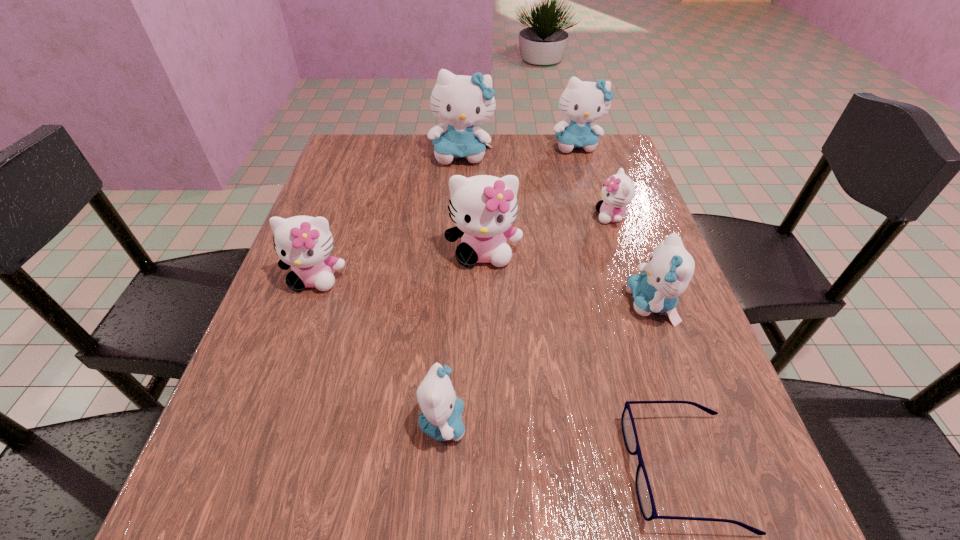
The image size is (960, 540). What are the coordinates of `the biggest blue kitten` in the screenshot? It's located at (461, 101).

I want to click on the tallest kitten, so click(x=461, y=101).

Locate an element on the screen. the second biggest blue kitten is located at coordinates [x=582, y=101].

Identify the location of the biggest white kitten. (483, 208).

Find the location of `the second nearest blue kitten`. the second nearest blue kitten is located at coordinates (670, 268).

Locate an element on the screen. the second smallest white kitten is located at coordinates (303, 242).

Identify the location of the leftmost kitten. Image resolution: width=960 pixels, height=540 pixels. (303, 242).

Locate an element on the screen. the rightmost white kitten is located at coordinates (618, 191).

This screenshot has height=540, width=960. I want to click on the third farthest kitten, so click(618, 191).

Locate an element on the screen. the nearest kitten is located at coordinates [441, 418].